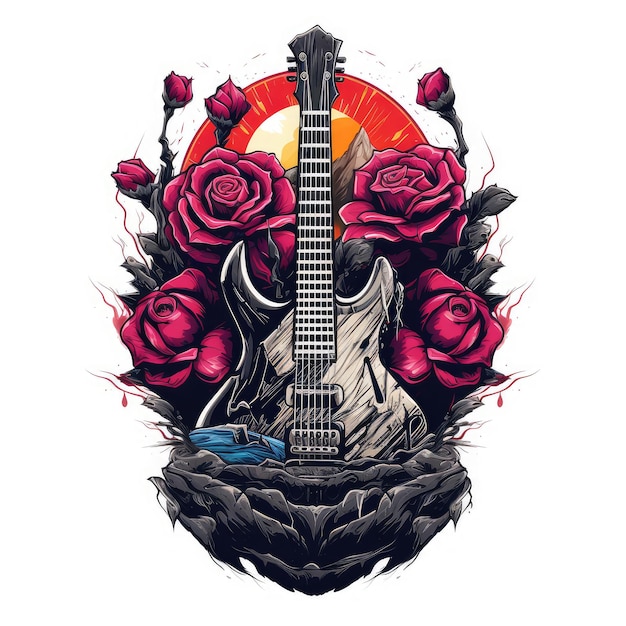
The image size is (626, 626). In order to click on holder in this screenshot , I will do `click(327, 73)`, `click(326, 57)`, `click(300, 48)`, `click(304, 79)`.